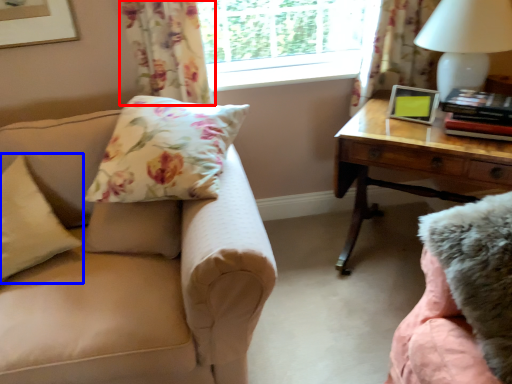
Question: Among these objects, which one is farthest to the camera, curtain (highlighted by a red box) or pillow (highlighted by a blue box)?

Choices:
 (A) curtain
 (B) pillow

Answer: (A)